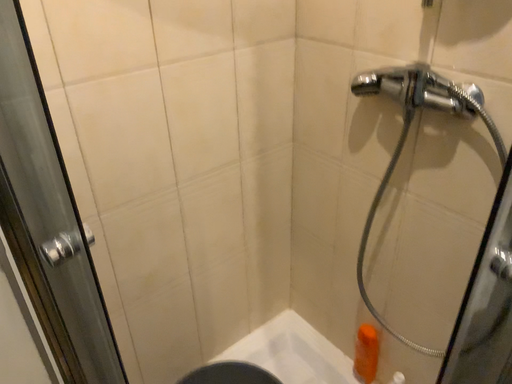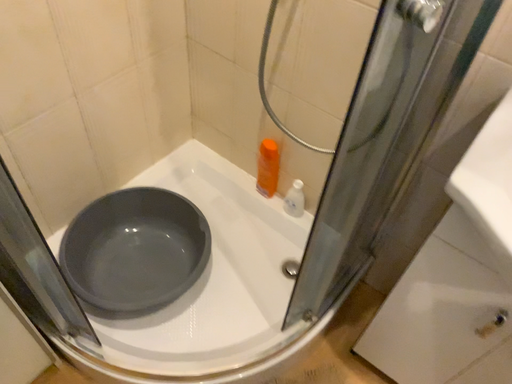
Question: Which way did the camera rotate in the video?

Choices:
 (A) rotated upward
 (B) rotated downward

Answer: (B)